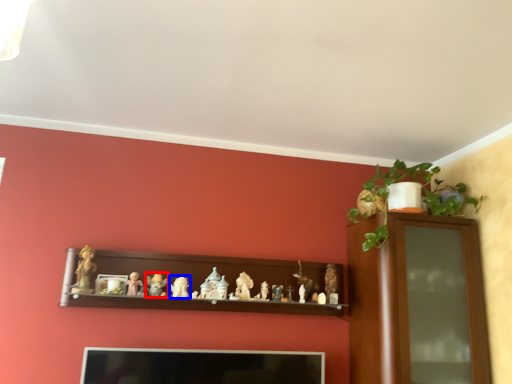
Question: Which object appears closest to the camera in this image, toy (highlighted by a red box) or toy (highlighted by a blue box)?

Choices:
 (A) toy
 (B) toy

Answer: (A)